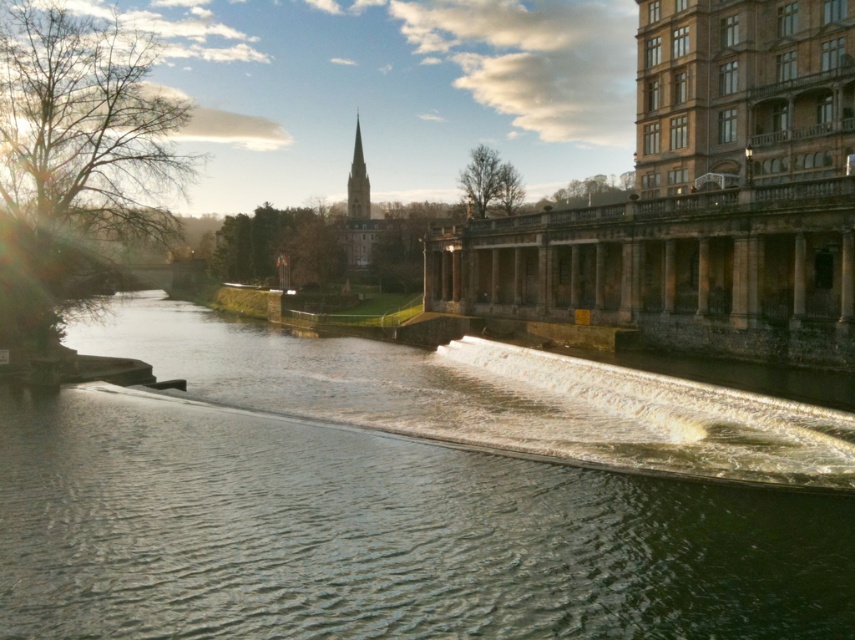
Does greenish water at center lie in front of smooth gray steeple at upper center?

Yes, it is.

The width and height of the screenshot is (855, 640). Find the location of `greenish water at center`. greenish water at center is located at coordinates click(370, 506).